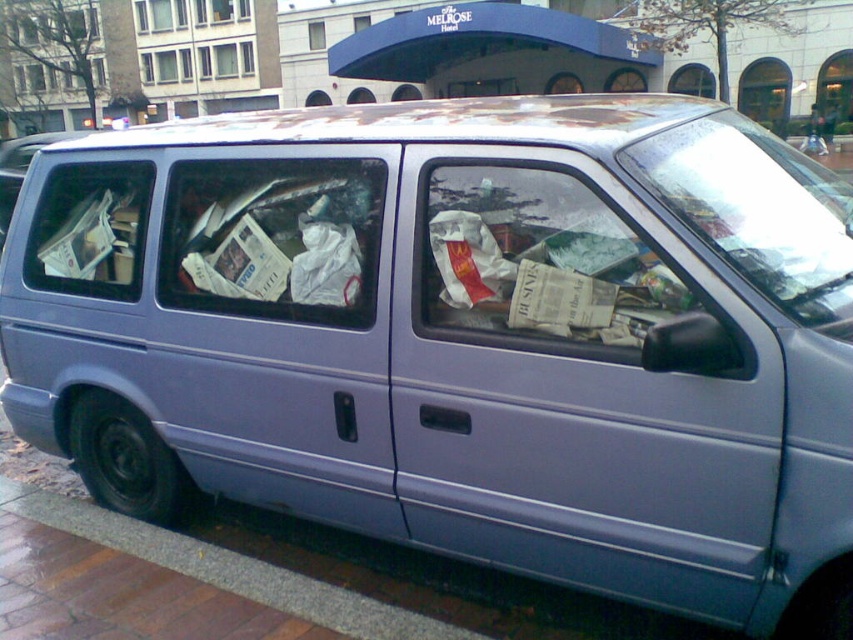
You are a delivery person standing at the gray concrete curb at lower left. You need to deliver a package to the Melrose Hotel. Which direction should you walk to reach the Melrose Hotel?

The Melrose Hotel is in the background of the scene, so you should walk away from the gray concrete curb at lower left towards the background to reach it.

You are a delivery person standing at point A, which is at coordinates (227, 568). You need to deliver a package to the Melrose Hotel entrance located at the building with the blue awning. Is the gray concrete curb at lower left blocking your direct path to the hotel entrance?

The gray concrete curb at lower left is located at point (227, 568), so it is at your current position. Therefore, it is not blocking your path to the Melrose Hotel entrance.